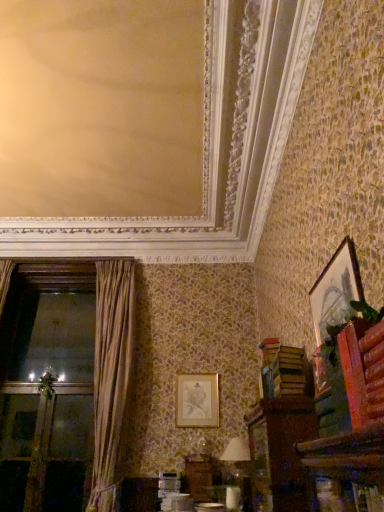
Question: From the image's perspective, is white fabric lampshade at lower center on top of green leafy plant at upper right?

Choices:
 (A) no
 (B) yes

Answer: (A)

Question: Considering the relative sizes of white fabric lampshade at lower center and green leafy plant at upper right in the image provided, is white fabric lampshade at lower center taller than green leafy plant at upper right?

Choices:
 (A) no
 (B) yes

Answer: (B)

Question: Does white fabric lampshade at lower center have a greater width compared to green leafy plant at upper right?

Choices:
 (A) yes
 (B) no

Answer: (A)

Question: Is white fabric lampshade at lower center positioned behind green leafy plant at upper right?

Choices:
 (A) yes
 (B) no

Answer: (A)

Question: Is white fabric lampshade at lower center placed right next to green leafy plant at upper right?

Choices:
 (A) no
 (B) yes

Answer: (A)

Question: Relative to brown velvet curtain at left, is green leafy plant at upper right in front or behind?

Choices:
 (A) behind
 (B) front

Answer: (B)

Question: Would you say green leafy plant at upper right is inside or outside brown velvet curtain at left?

Choices:
 (A) outside
 (B) inside

Answer: (A)

Question: Is green leafy plant at upper right taller or shorter than brown velvet curtain at left?

Choices:
 (A) short
 (B) tall

Answer: (A)

Question: From the image's perspective, relative to brown velvet curtain at left, is green leafy plant at upper right above or below?

Choices:
 (A) above
 (B) below

Answer: (A)

Question: Is brown wooden cabinet at lower right wider or thinner than gold-framed picture at upper right, which is the second picture frame from bottom to top?

Choices:
 (A) wide
 (B) thin

Answer: (A)

Question: From the image's perspective, relative to gold-framed picture at upper right, the second picture frame when ordered from back to front, is brown wooden cabinet at lower right above or below?

Choices:
 (A) below
 (B) above

Answer: (A)

Question: Is brown wooden cabinet at lower right to the left or to the right of gold-framed picture at upper right, the second picture frame when ordered from back to front, in the image?

Choices:
 (A) left
 (B) right

Answer: (A)

Question: Considering their positions, is brown wooden cabinet at lower right located in front of or behind gold-framed picture at upper right, which is the second picture frame from bottom to top?

Choices:
 (A) front
 (B) behind

Answer: (B)

Question: Is brown velvet curtain at left bigger or smaller than gold metallic picture frame at center, which is the second picture frame in front-to-back order?

Choices:
 (A) small
 (B) big

Answer: (B)

Question: Considering the positions of brown velvet curtain at left and gold metallic picture frame at center, which ranks as the first picture frame in bottom-to-top order, in the image, is brown velvet curtain at left wider or thinner than gold metallic picture frame at center, which ranks as the first picture frame in bottom-to-top order,?

Choices:
 (A) thin
 (B) wide

Answer: (B)